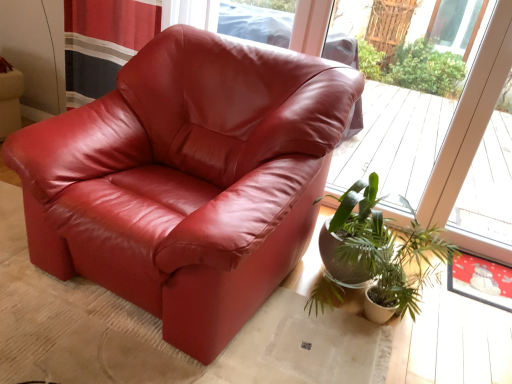
Question: Is point (203, 49) positioned closer to the camera than point (408, 279)?

Choices:
 (A) closer
 (B) farther

Answer: (B)

Question: Considering the positions of matte leather armchair at center and green leafy plant at lower right in the image, is matte leather armchair at center taller or shorter than green leafy plant at lower right?

Choices:
 (A) short
 (B) tall

Answer: (B)

Question: Which object is positioned closest to the matte leather armchair at center?

Choices:
 (A) green leafy plant at lower right
 (B) transparent glass window at upper center

Answer: (A)

Question: Which object is the closest to the green leafy plant at lower right?

Choices:
 (A) matte leather armchair at center
 (B) transparent glass window at upper center

Answer: (A)